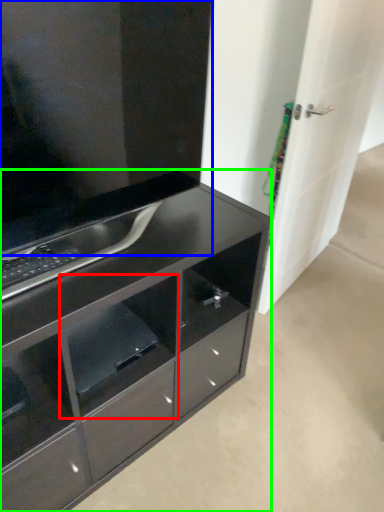
Question: Based on their relative distances, which object is farther from shelf (highlighted by a red box)? Choose from cabinetry (highlighted by a blue box) and chest of drawers (highlighted by a green box).

Choices:
 (A) cabinetry
 (B) chest of drawers

Answer: (A)